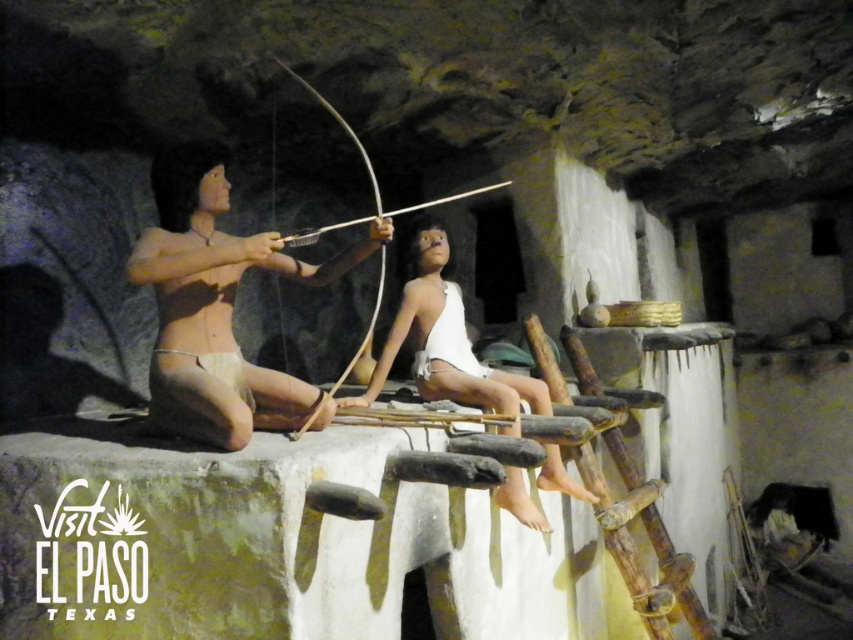
Is matte tan skin at center positioned at the back of white matte wood at center?

No, it is not.

Identify the location of matte tan skin at center. (218, 307).

Locate an element on the screen. matte tan skin at center is located at coordinates click(218, 307).

Is matte tan skin at center taller than wooden bow and arrow at center?

In fact, matte tan skin at center may be shorter than wooden bow and arrow at center.

How much distance is there between matte tan skin at center and wooden bow and arrow at center?

A distance of 20.93 inches exists between matte tan skin at center and wooden bow and arrow at center.

Does point (215, 422) come behind point (340, 372)?

No.

You are a GUI agent. You are given a task and a screenshot of the screen. Output one action in this format:
    pyautogui.click(x=<x>, y=<y>)
    Task: Click on the matte tan skin at center
    
    Given the screenshot: What is the action you would take?
    pyautogui.click(x=218, y=307)

Who is shorter, white matte wood at center or wooden bow and arrow at center?

white matte wood at center is shorter.

Find the location of a particular element. This screenshot has width=853, height=640. white matte wood at center is located at coordinates (445, 340).

The height and width of the screenshot is (640, 853). What are the coordinates of `white matte wood at center` in the screenshot? It's located at (445, 340).